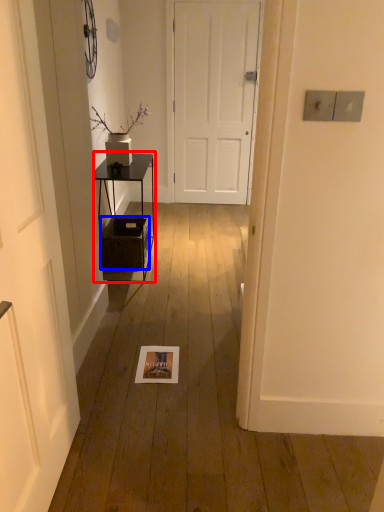
Question: Which of the following is the farthest to the observer, table (highlighted by a red box) or crate (highlighted by a blue box)?

Choices:
 (A) table
 (B) crate

Answer: (B)